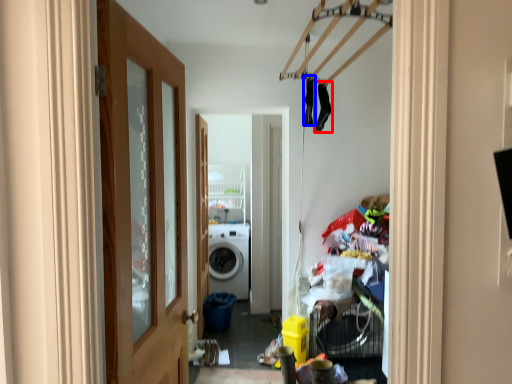
Question: Which object is closer to the camera taking this photo, clothing (highlighted by a red box) or clothing (highlighted by a blue box)?

Choices:
 (A) clothing
 (B) clothing

Answer: (B)